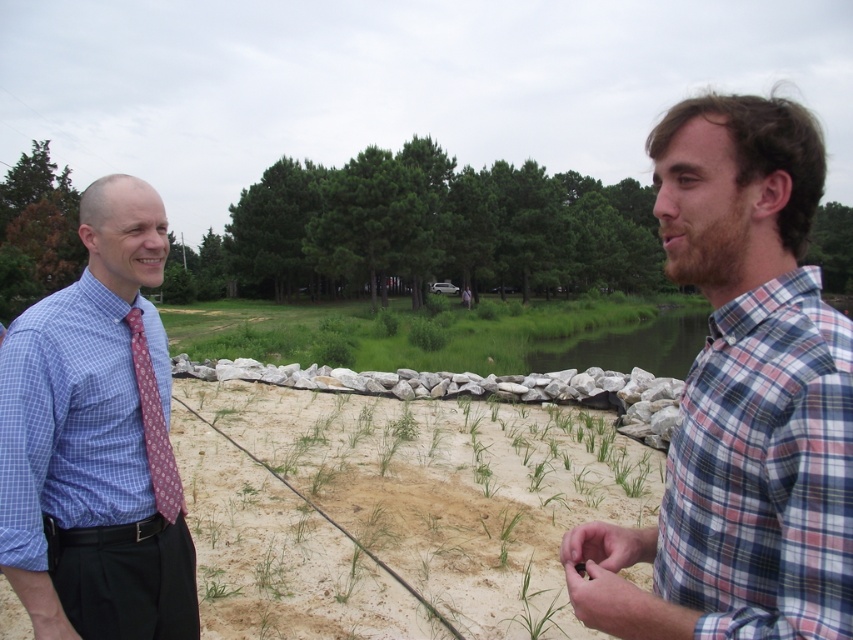
Between plaid fabric shirt at right and maroon printed tie at left, which one is positioned lower?

plaid fabric shirt at right is below.

Between point (817, 445) and point (144, 362), which one is positioned behind?

The point (144, 362) is behind.

Locate an element on the screen. plaid fabric shirt at right is located at coordinates (763, 470).

Is blue checkered shirt at left in front of plaid fabric shirt at right?

No, it is not.

Does blue checkered shirt at left have a smaller size compared to plaid fabric shirt at right?

Indeed, blue checkered shirt at left has a smaller size compared to plaid fabric shirt at right.

Find the location of a particular element. blue checkered shirt at left is located at coordinates (94, 438).

Where is `blue checkered shirt at left`? blue checkered shirt at left is located at coordinates (94, 438).

From the picture: Between green smooth water at center and maroon printed tie at left, which one is positioned higher?

green smooth water at center is above.

The height and width of the screenshot is (640, 853). I want to click on green smooth water at center, so click(x=630, y=346).

Between point (604, 368) and point (144, 390), which one is positioned behind?

Point (604, 368)

At what (x,y) coordinates should I click in order to perform the action: click on green smooth water at center. Please return your answer as a coordinate pair (x, y). This screenshot has width=853, height=640. Looking at the image, I should click on (630, 346).